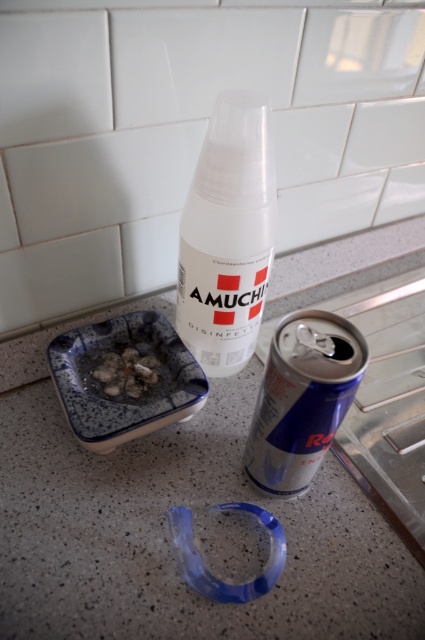
Locate an element on the screen. This screenshot has width=425, height=640. transparent plastic spray bottle at center is located at coordinates (227, 236).

Between point (201, 202) and point (303, 396), which one is positioned in front?

Point (303, 396) is more forward.

Is point (261, 276) less distant than point (255, 449)?

No, it is not.

Locate an element on the screen. This screenshot has width=425, height=640. transparent plastic spray bottle at center is located at coordinates (227, 236).

Does transparent plastic spray bottle at center have a greater width compared to white crumbly food at center?

Yes, transparent plastic spray bottle at center is wider than white crumbly food at center.

Which is behind, point (214, 259) or point (116, 371)?

Positioned behind is point (116, 371).

Locate an element on the screen. This screenshot has height=640, width=425. transparent plastic spray bottle at center is located at coordinates (227, 236).

Which is behind, point (323, 388) or point (113, 365)?

The point (113, 365) is behind.

Does blue metallic can at center have a lesser width compared to white crumbly food at center?

No, blue metallic can at center is not thinner than white crumbly food at center.

At what (x,y) coordinates should I click in order to perform the action: click on blue metallic can at center. Please return your answer as a coordinate pair (x, y). The height and width of the screenshot is (640, 425). Looking at the image, I should click on (303, 397).

You are a GUI agent. You are given a task and a screenshot of the screen. Output one action in this format:
    pyautogui.click(x=<x>, y=<y>)
    Task: Click on the blue metallic can at center
    The height and width of the screenshot is (640, 425).
    Given the screenshot: What is the action you would take?
    pyautogui.click(x=303, y=397)